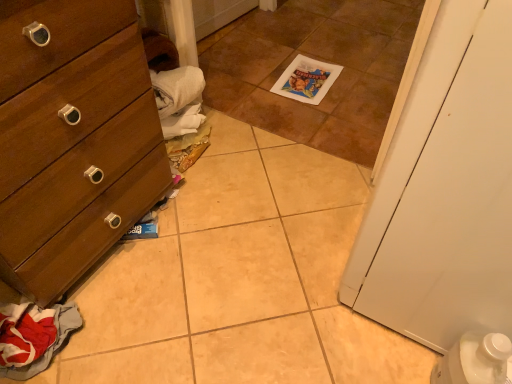
Question: Is white matte door at right completely or partially outside of wooden dresser at left?

Choices:
 (A) yes
 (B) no

Answer: (A)

Question: Can you confirm if white matte door at right is positioned to the right of wooden dresser at left?

Choices:
 (A) no
 (B) yes

Answer: (B)

Question: From a real-world perspective, is white matte door at right positioned over wooden dresser at left based on gravity?

Choices:
 (A) no
 (B) yes

Answer: (B)

Question: Does white matte door at right come in front of wooden dresser at left?

Choices:
 (A) no
 (B) yes

Answer: (B)

Question: Considering the relative sizes of white matte door at right and wooden dresser at left in the image provided, is white matte door at right bigger than wooden dresser at left?

Choices:
 (A) no
 (B) yes

Answer: (A)

Question: Is the position of white matte door at right more distant than that of wooden dresser at left?

Choices:
 (A) no
 (B) yes

Answer: (A)

Question: Is wooden dresser at left facing away from red fabric clothes at lower left?

Choices:
 (A) yes
 (B) no

Answer: (B)

Question: Does wooden dresser at left have a larger size compared to red fabric clothes at lower left?

Choices:
 (A) no
 (B) yes

Answer: (B)

Question: Could you tell me if wooden dresser at left is turned towards red fabric clothes at lower left?

Choices:
 (A) no
 (B) yes

Answer: (A)

Question: Is wooden dresser at left not within red fabric clothes at lower left?

Choices:
 (A) no
 (B) yes

Answer: (B)

Question: Considering the relative positions of wooden dresser at left and red fabric clothes at lower left in the image provided, is wooden dresser at left to the right of red fabric clothes at lower left from the viewer's perspective?

Choices:
 (A) no
 (B) yes

Answer: (B)

Question: Considering the relative positions of wooden dresser at left and red fabric clothes at lower left in the image provided, is wooden dresser at left in front of red fabric clothes at lower left?

Choices:
 (A) no
 (B) yes

Answer: (B)

Question: Is brown tile at center inside white matte door at right?

Choices:
 (A) yes
 (B) no

Answer: (B)